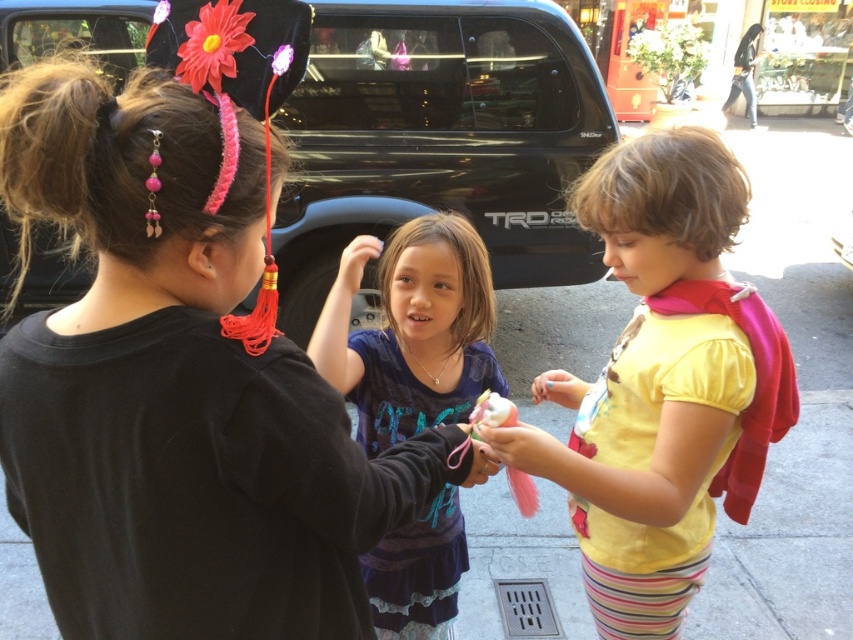
Which of these two, yellow cotton shirt at center or purple cotton shirt at center, stands taller?

purple cotton shirt at center is taller.

Is yellow cotton shirt at center above purple cotton shirt at center?

Correct, yellow cotton shirt at center is located above purple cotton shirt at center.

You are a GUI agent. You are given a task and a screenshot of the screen. Output one action in this format:
    pyautogui.click(x=<x>, y=<y>)
    Task: Click on the yellow cotton shirt at center
    
    Given the screenshot: What is the action you would take?
    pyautogui.click(x=663, y=384)